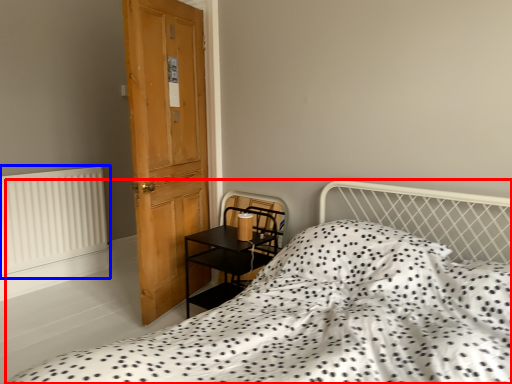
Question: Which object appears closest to the camera in this image, bed (highlighted by a red box) or radiator (highlighted by a blue box)?

Choices:
 (A) bed
 (B) radiator

Answer: (A)